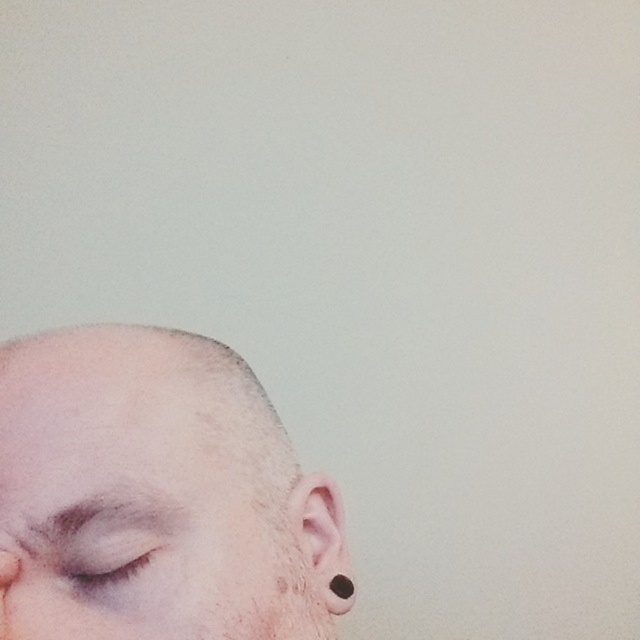
You are a photographer adjusting the lighting for a closeup shot of a person. You notice the pink matte ear at lower right and the black matte earring at lower left in the frame. Which object is positioned more to the left side of the image?

The pink matte ear at lower right is to the left of the black matte earring at lower left, so the pink matte ear at lower right is positioned more to the left side of the image.

Based on the photo, you are a photographer adjusting lighting for a closeup portrait. You notice the matte skin eye at lower left and the black matte earring at lower left in your frame. Which object should you focus on to ensure the leftmost part of the face is properly lit?

The matte skin eye at lower left is to the left of the black matte earring at lower left, so you should focus on the matte skin eye at lower left to ensure the leftmost part of the face is properly lit.

You are a photographer adjusting the lighting for a closeup portrait of a person. You need to ensure that the matte skin eye at lower left is well lit. Based on the scene description, where should you position the light source relative to the subject?

The matte skin eye at lower left is positioned at point (106, 556). To ensure proper lighting, position the light source slightly to the right and above the eye to avoid harsh shadows and evenly illuminate the area.